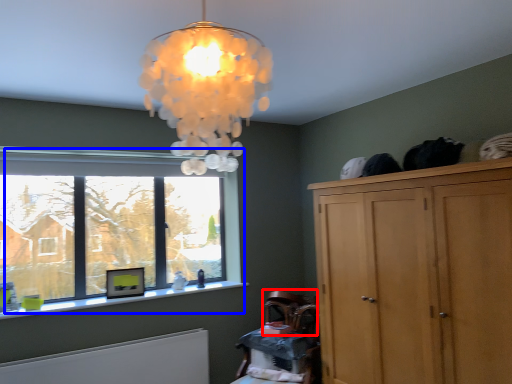
Question: Among these objects, which one is farthest to the camera, armchair (highlighted by a red box) or window (highlighted by a blue box)?

Choices:
 (A) armchair
 (B) window

Answer: (A)